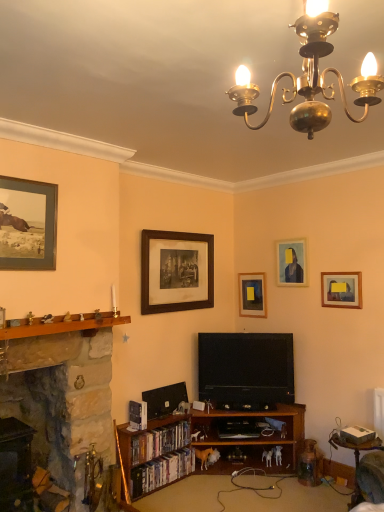
What are the coordinates of `vacant area on top of wooden at left (from a real-world perspective)` in the screenshot? It's located at coord(67,316).